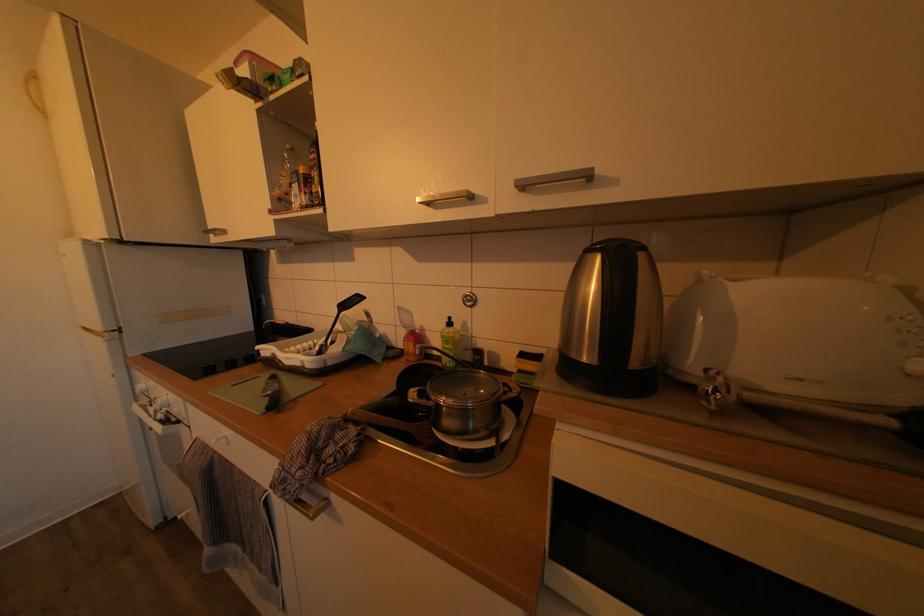
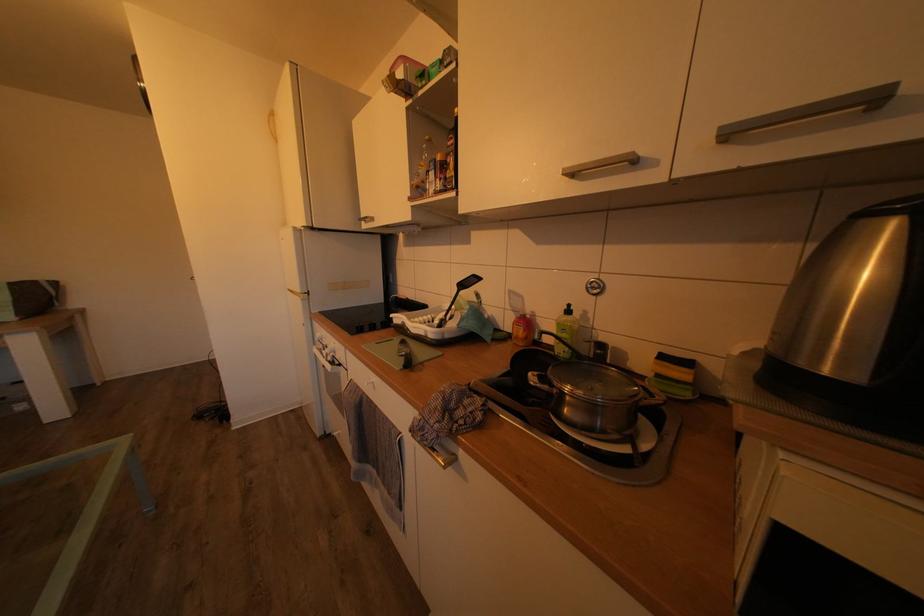
The point at (602,367) is marked in the first image. Where is the corresponding point in the second image?

(868, 385)